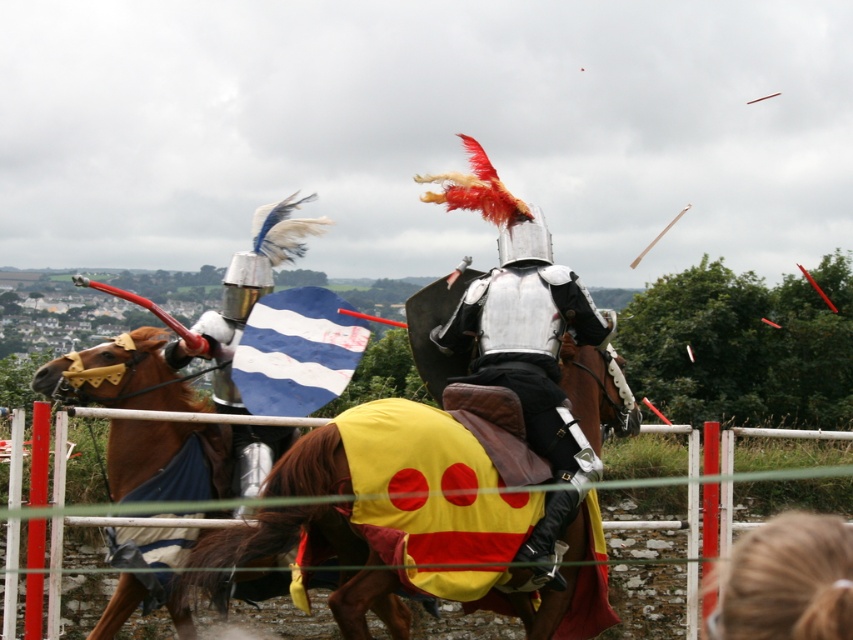
Based on the photo, is white metal fence at lower center shorter than blonde hair at lower right?

Incorrect, white metal fence at lower center's height does not fall short of blonde hair at lower right's.

Is white metal fence at lower center positioned before blonde hair at lower right?

No.

Between point (265, 416) and point (824, 621), which one is positioned in front?

Positioned in front is point (824, 621).

This screenshot has width=853, height=640. What are the coordinates of `white metal fence at lower center` in the screenshot? It's located at (96, 525).

Which of these two, yellow fabric horse at center or white metal fence at lower center, stands taller?

white metal fence at lower center

Can you confirm if yellow fabric horse at center is wider than white metal fence at lower center?

In fact, yellow fabric horse at center might be narrower than white metal fence at lower center.

You are a GUI agent. You are given a task and a screenshot of the screen. Output one action in this format:
    pyautogui.click(x=<x>, y=<y>)
    Task: Click on the yellow fabric horse at center
    This screenshot has height=640, width=853.
    Given the screenshot: What is the action you would take?
    pyautogui.click(x=323, y=560)

Is yellow fabric horse at center to the left of shiny silver armor at center from the viewer's perspective?

Yes, yellow fabric horse at center is to the left of shiny silver armor at center.

Which of these two, yellow fabric horse at center or shiny silver armor at center, stands taller?

shiny silver armor at center

Is point (537, 624) closer to viewer compared to point (508, 276)?

Yes.

I want to click on yellow fabric horse at center, so click(x=323, y=560).